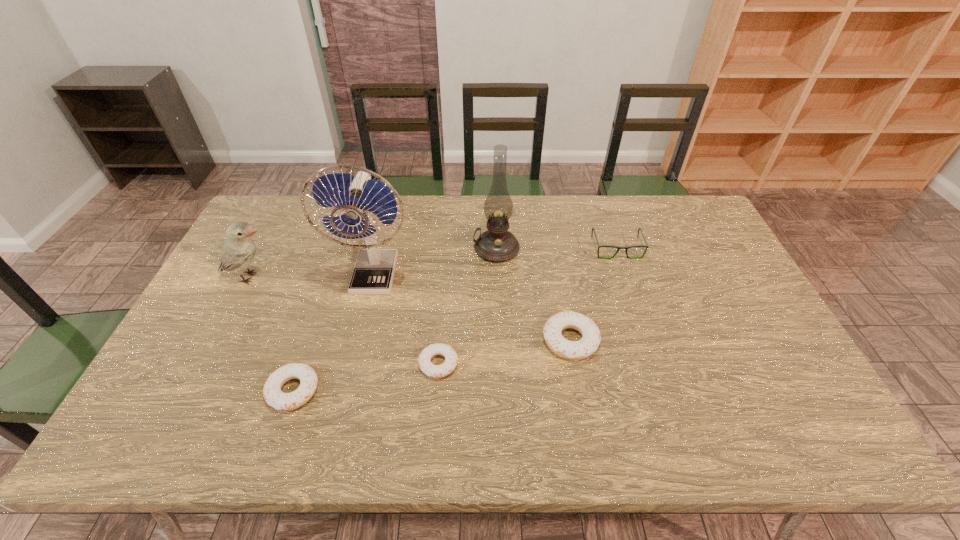
In order to click on free space between the sixth tallest object and the fifth shortest object in this screenshot , I will do `click(272, 334)`.

Where is `empty location between the leftmost doughnut and the fan`? The height and width of the screenshot is (540, 960). empty location between the leftmost doughnut and the fan is located at coordinates (334, 333).

Where is `free space between the shortest doughnut and the rightmost object`? The height and width of the screenshot is (540, 960). free space between the shortest doughnut and the rightmost object is located at coordinates (528, 306).

Where is `vacant region between the second tallest doughnut and the shortest object`? vacant region between the second tallest doughnut and the shortest object is located at coordinates (366, 377).

At what (x,y) coordinates should I click in order to perform the action: click on unoccupied area between the fan and the leftmost object. Please return your answer as a coordinate pair (x, y). The image size is (960, 540). Looking at the image, I should click on (313, 276).

Where is `empty space between the fan and the third object from right to left`? empty space between the fan and the third object from right to left is located at coordinates (436, 262).

Where is `free space between the second shortest doughnut and the third tallest object`? Image resolution: width=960 pixels, height=540 pixels. free space between the second shortest doughnut and the third tallest object is located at coordinates (272, 334).

The width and height of the screenshot is (960, 540). I want to click on object identified as the third closest to the sixth tallest object, so click(238, 252).

Select which object is the fourth closest to the leftmost doughnut. Please provide its 2D coordinates. Your answer should be formatted as a tuple, i.e. [(x, y)], where the tuple contains the x and y coordinates of a point satisfying the conditions above.

[(496, 244)]

Identify the location of doughnut that is the nearest to the tallest doughnut. (424, 361).